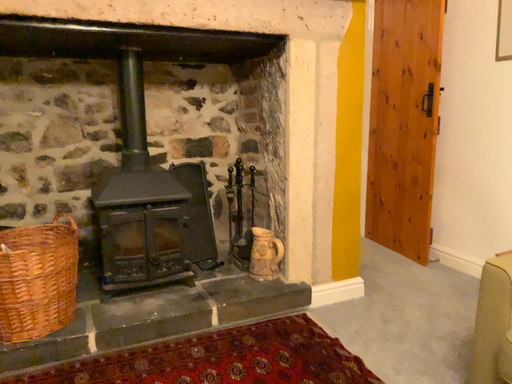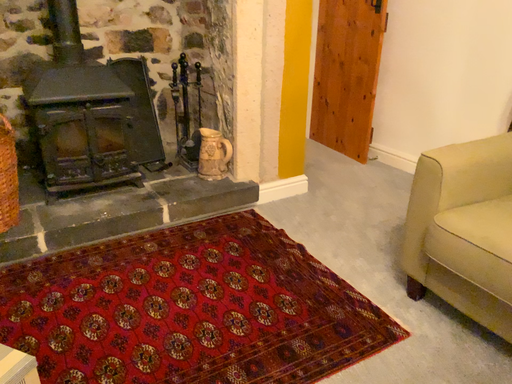
Question: Which way did the camera rotate in the video?

Choices:
 (A) rotated downward
 (B) rotated upward

Answer: (A)